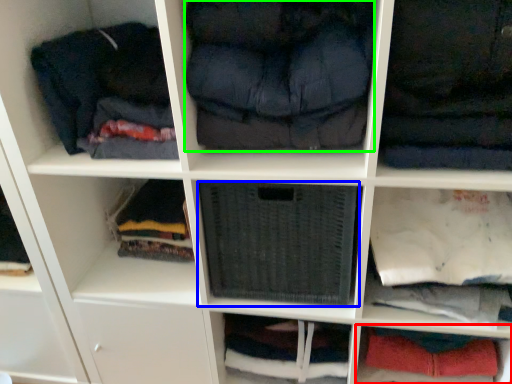
Question: Estimate the real-world distances between objects in this image. Which object is closer to cabinet (highlighted by a red box), cabinet (highlighted by a blue box) or clothing (highlighted by a green box)?

Choices:
 (A) cabinet
 (B) clothing

Answer: (A)